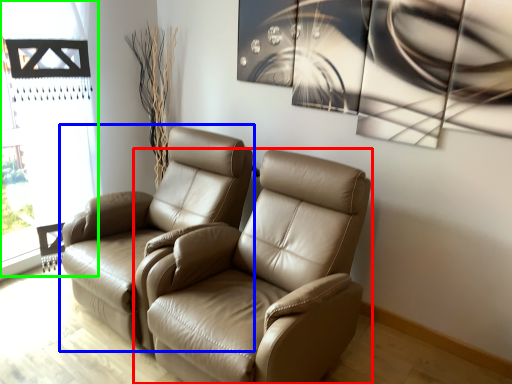
Question: Considering the real-world distances, which object is farthest from chair (highlighted by a red box)? chair (highlighted by a blue box) or window frame (highlighted by a green box)?

Choices:
 (A) chair
 (B) window frame

Answer: (B)